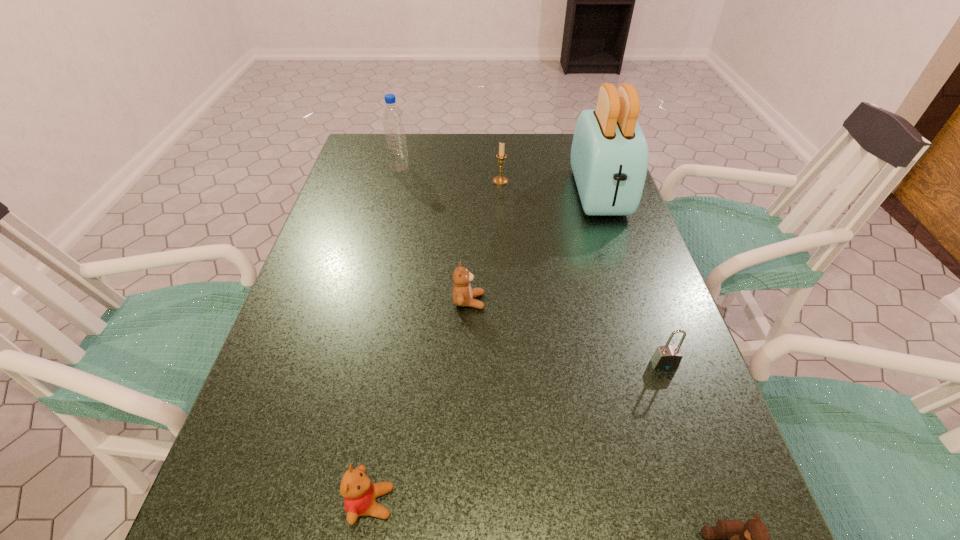
Find the location of a particular element. the tallest object is located at coordinates (609, 158).

Image resolution: width=960 pixels, height=540 pixels. I want to click on the second tallest object, so click(393, 122).

Locate an element on the screen. water bottle is located at coordinates (393, 122).

Locate an element on the screen. the fourth object from right to left is located at coordinates (500, 180).

Find the location of a particular element. The image size is (960, 540). the fifth shortest object is located at coordinates (500, 180).

The image size is (960, 540). Identify the location of the fourth nearest object. (463, 295).

Locate an element on the screen. the farthest teddy bear is located at coordinates (463, 295).

Identify the location of padlock. The image size is (960, 540). (667, 357).

Locate an element on the screen. This screenshot has width=960, height=540. the leftmost teddy bear is located at coordinates (359, 493).

The image size is (960, 540). In order to click on free space located 0.050m on the side of the toaster with the lever in this screenshot , I will do `click(613, 237)`.